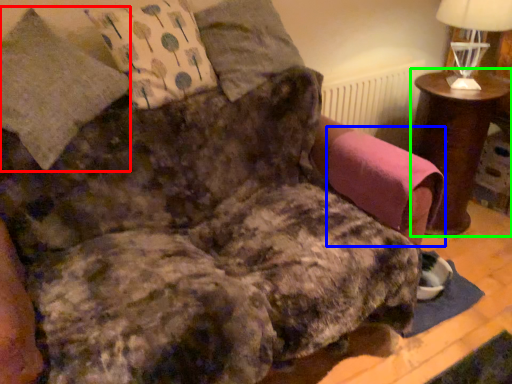
Question: Based on their relative distances, which object is farther from pillow (highlighted by a red box)? Choose from swivel chair (highlighted by a blue box) and table (highlighted by a green box).

Choices:
 (A) swivel chair
 (B) table

Answer: (B)